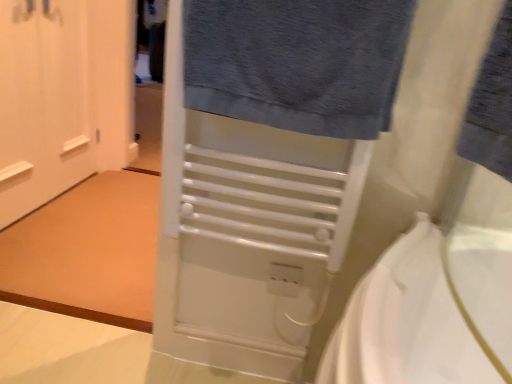
Find the location of a particular element. Image resolution: width=512 pixels, height=384 pixels. free space to the right of white matte door at left is located at coordinates (115, 206).